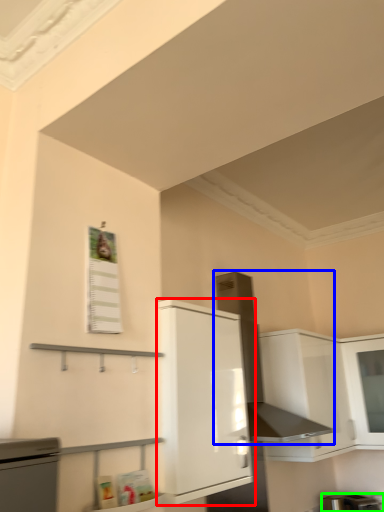
Question: Considering the real-world distances, which object is closest to cabinetry (highlighted by a red box)? exhaust hood (highlighted by a blue box) or appliance (highlighted by a green box).

Choices:
 (A) exhaust hood
 (B) appliance

Answer: (A)